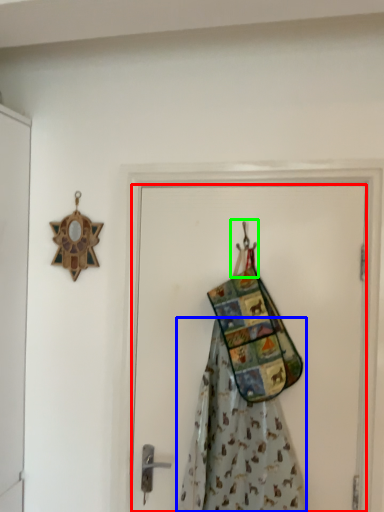
Question: Which object is positioned farthest from door (highlighted by a red box)? Select from fancy dress (highlighted by a blue box) and hanger (highlighted by a green box).

Choices:
 (A) fancy dress
 (B) hanger

Answer: (B)